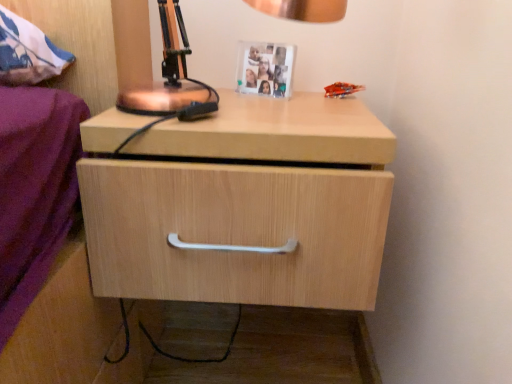
Question: Considering their positions, is light wood drawer at center located in front of or behind copper metallic table lamp at upper center?

Choices:
 (A) front
 (B) behind

Answer: (B)

Question: In terms of width, does light wood drawer at center look wider or thinner when compared to copper metallic table lamp at upper center?

Choices:
 (A) wide
 (B) thin

Answer: (A)

Question: Which is farther from the white plastic picture frame at upper center?

Choices:
 (A) light wood drawer at center
 (B) copper metallic table lamp at upper center

Answer: (A)

Question: Which is farther from the copper metallic table lamp at upper center?

Choices:
 (A) white plastic picture frame at upper center
 (B) light wood drawer at center

Answer: (B)